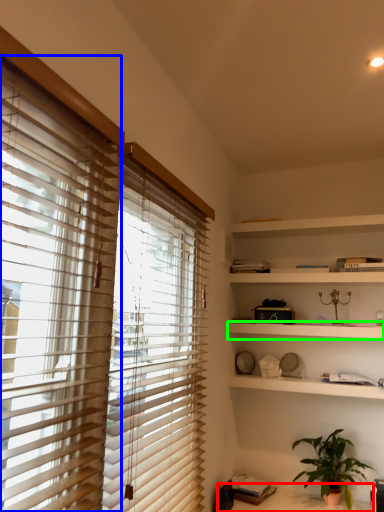
Question: Considering the real-world distances, which object is farthest from table (highlighted by a red box)? window blind (highlighted by a blue box) or shelf (highlighted by a green box)?

Choices:
 (A) window blind
 (B) shelf

Answer: (A)